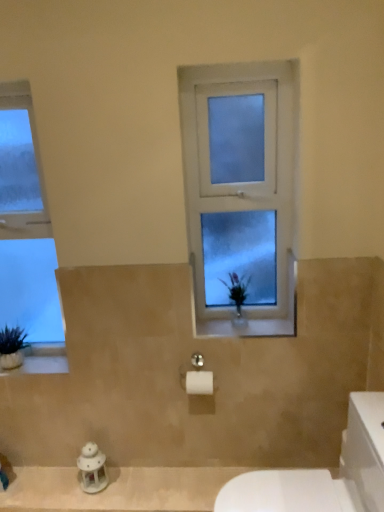
Question: Is white stone window sill at lower left in front of or behind white porcelain lantern at lower left in the image?

Choices:
 (A) front
 (B) behind

Answer: (B)

Question: Is white stone window sill at lower left bigger or smaller than white porcelain lantern at lower left?

Choices:
 (A) big
 (B) small

Answer: (B)

Question: Estimate the real-world distances between objects in this image. Which object is farther from the clear glass window at left, the second window viewed from the right?

Choices:
 (A) frosted glass window at center, positioned as the first window in right-to-left order
 (B) white stone window sill at lower left
 (C) white glossy porcelain at lower right
 (D) white porcelain lantern at lower left

Answer: (C)

Question: Which of these objects is positioned closest to the clear glass window at left, the second window viewed from the right?

Choices:
 (A) white glossy porcelain at lower right
 (B) frosted glass window at center, positioned as the first window in right-to-left order
 (C) white porcelain lantern at lower left
 (D) white stone window sill at lower left

Answer: (D)